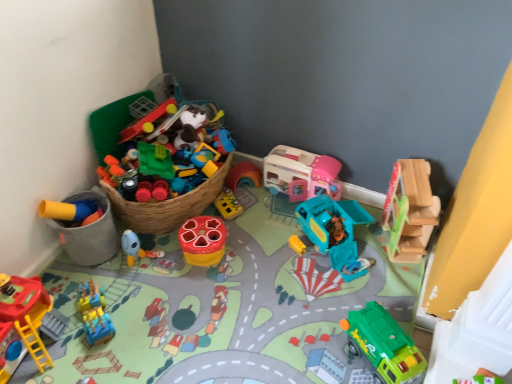
Image resolution: width=512 pixels, height=384 pixels. What are the coordinates of `vacant region to the left of teal plastic truck at center, which is the 6th toy in left-to-right order` in the screenshot? It's located at (261, 242).